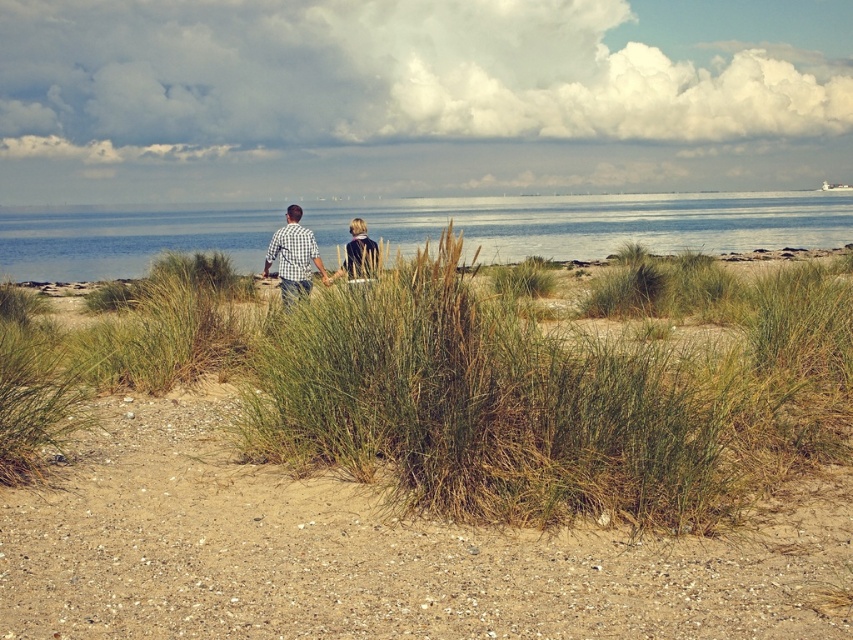
Is brown sandy soil at lower center below checkered fabric shirt at center?

Yes, brown sandy soil at lower center is below checkered fabric shirt at center.

Can you confirm if brown sandy soil at lower center is thinner than checkered fabric shirt at center?

No, brown sandy soil at lower center is not thinner than checkered fabric shirt at center.

Between point (115, 440) and point (294, 214), which one is positioned in front?

Positioned in front is point (115, 440).

Identify the location of brown sandy soil at lower center. (378, 552).

Is point (282, 275) in front of point (369, 241)?

No, it is behind (369, 241).

Between checkered fabric shirt at center and dark blue jacket at center, which one has more height?

With more height is dark blue jacket at center.

Who is more distant from viewer, (276, 232) or (361, 240)?

The point (276, 232) is behind.

This screenshot has width=853, height=640. I want to click on checkered fabric shirt at center, so click(293, 257).

In the scene shown: Can you confirm if brown sandy soil at lower center is positioned to the left of dark blue jacket at center?

Incorrect, brown sandy soil at lower center is not on the left side of dark blue jacket at center.

Based on the photo, is brown sandy soil at lower center smaller than dark blue jacket at center?

Yes, brown sandy soil at lower center is smaller than dark blue jacket at center.

Which is behind, point (390, 580) or point (369, 252)?

Positioned behind is point (369, 252).

Identify the location of brown sandy soil at lower center. The height and width of the screenshot is (640, 853). (378, 552).